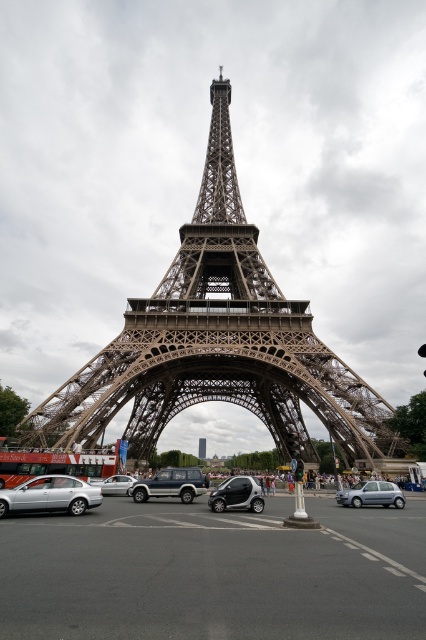
In the scene shown: Is brown metal eiffel tower at center smaller than shiny silver car at center?

No.

Is point (207, 227) positioned behind point (224, 490)?

Yes, it is.

The image size is (426, 640). I want to click on brown metal eiffel tower at center, so click(x=216, y=342).

Is red metallic bus at lower left taller than silver metallic car at center?

Yes, red metallic bus at lower left is taller than silver metallic car at center.

Can you confirm if red metallic bus at lower left is positioned to the left of silver metallic car at center?

Correct, you'll find red metallic bus at lower left to the left of silver metallic car at center.

Measure the distance between red metallic bus at lower left and camera.

They are 89.15 meters apart.

I want to click on red metallic bus at lower left, so click(x=52, y=464).

From the picture: Which is more to the left, red metallic bus at lower left or silver metallic hatchback at lower center?

red metallic bus at lower left is more to the left.

Is red metallic bus at lower left further to the viewer compared to silver metallic hatchback at lower center?

That is True.

What do you see at coordinates (52, 464) in the screenshot? I see `red metallic bus at lower left` at bounding box center [52, 464].

Find the location of a particular element. red metallic bus at lower left is located at coordinates (52, 464).